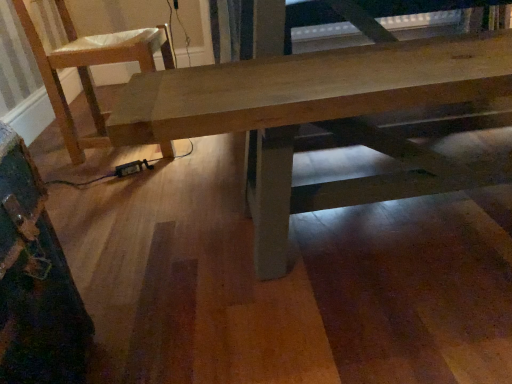
Question: Could wooden table at center be considered to be inside light brown wood chair at upper left?

Choices:
 (A) yes
 (B) no

Answer: (B)

Question: Does light brown wood chair at upper left have a smaller size compared to wooden table at center?

Choices:
 (A) yes
 (B) no

Answer: (A)

Question: Does light brown wood chair at upper left come behind wooden table at center?

Choices:
 (A) yes
 (B) no

Answer: (A)

Question: Considering the relative sizes of light brown wood chair at upper left and wooden table at center in the image provided, is light brown wood chair at upper left taller than wooden table at center?

Choices:
 (A) no
 (B) yes

Answer: (B)

Question: From a real-world perspective, is light brown wood chair at upper left positioned over wooden table at center based on gravity?

Choices:
 (A) yes
 (B) no

Answer: (A)

Question: Would you say light brown wood chair at upper left is a long distance from wooden table at center?

Choices:
 (A) no
 (B) yes

Answer: (A)

Question: Is wooden table at center thinner than light brown wood chair at upper left?

Choices:
 (A) no
 (B) yes

Answer: (B)

Question: From a real-world perspective, is wooden table at center physically below light brown wood chair at upper left?

Choices:
 (A) no
 (B) yes

Answer: (B)

Question: Does wooden table at center have a greater height compared to light brown wood chair at upper left?

Choices:
 (A) yes
 (B) no

Answer: (B)

Question: From the image's perspective, does wooden table at center appear lower than light brown wood chair at upper left?

Choices:
 (A) yes
 (B) no

Answer: (A)

Question: Considering the relative sizes of wooden table at center and light brown wood chair at upper left in the image provided, is wooden table at center shorter than light brown wood chair at upper left?

Choices:
 (A) yes
 (B) no

Answer: (A)

Question: Does wooden table at center have a larger size compared to light brown wood chair at upper left?

Choices:
 (A) yes
 (B) no

Answer: (A)

Question: From the image's perspective, relative to light brown wood chair at upper left, is wooden table at center above or below?

Choices:
 (A) below
 (B) above

Answer: (A)